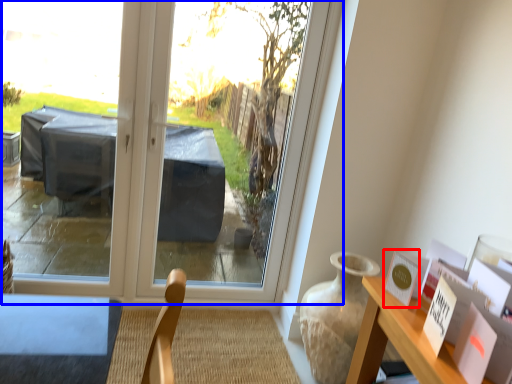
Question: Among these objects, which one is nearest to the camera, postcard (highlighted by a red box) or window (highlighted by a blue box)?

Choices:
 (A) postcard
 (B) window

Answer: (A)